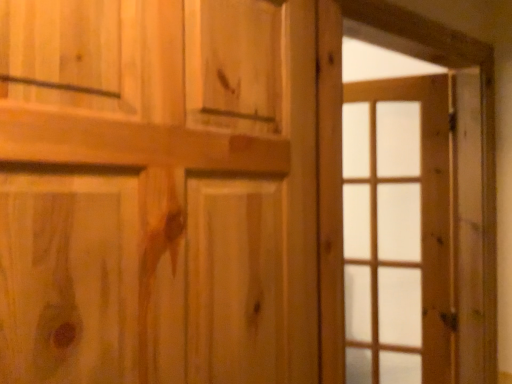
Question: In terms of size, does natural wood door at center appear bigger or smaller than clear glass door at right?

Choices:
 (A) big
 (B) small

Answer: (A)

Question: Does point (146, 158) appear closer or farther from the camera than point (413, 314)?

Choices:
 (A) farther
 (B) closer

Answer: (B)

Question: Which object is the farthest from the clear glass door at right?

Choices:
 (A) wooden barn door at right
 (B) natural wood door at center

Answer: (B)

Question: Which is nearer to the wooden barn door at right?

Choices:
 (A) natural wood door at center
 (B) clear glass door at right

Answer: (A)